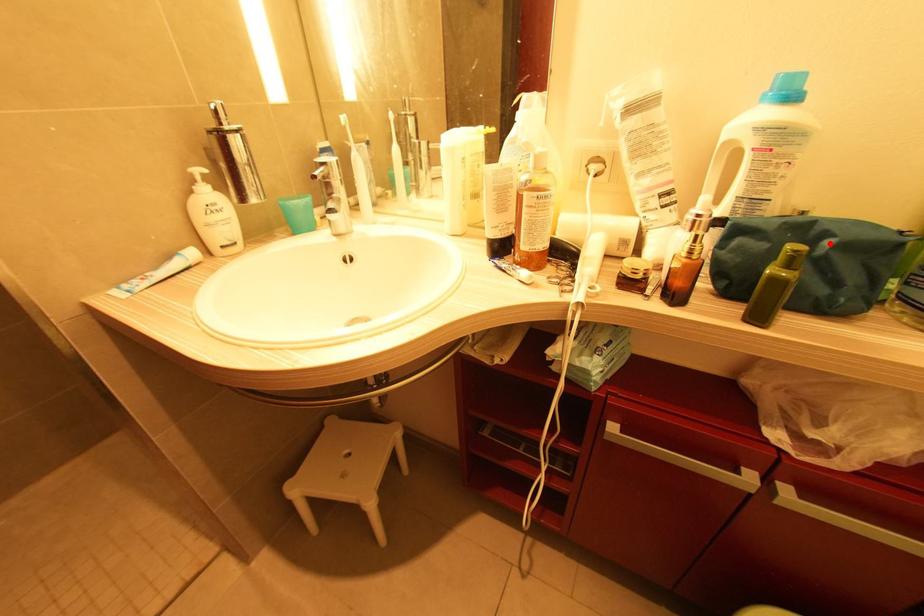
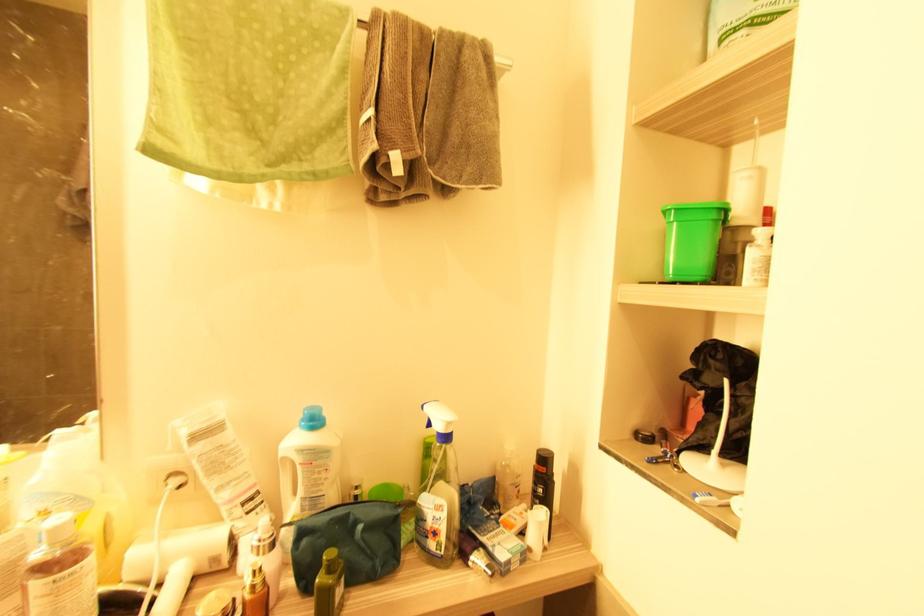
Locate, in the second image, the point that corresponds to the highlighted location in the first image.

(361, 529)